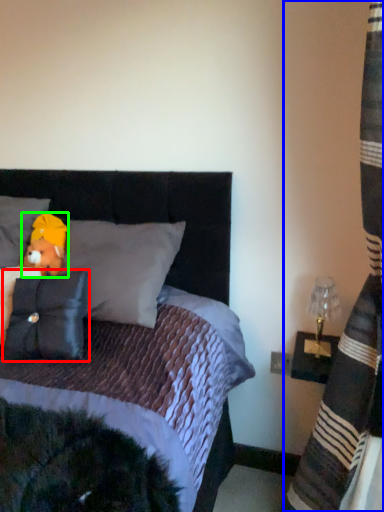
Question: Considering the real-world distances, which object is closest to pillow (highlighted by a red box)? curtain (highlighted by a blue box) or figurine (highlighted by a green box).

Choices:
 (A) curtain
 (B) figurine

Answer: (B)